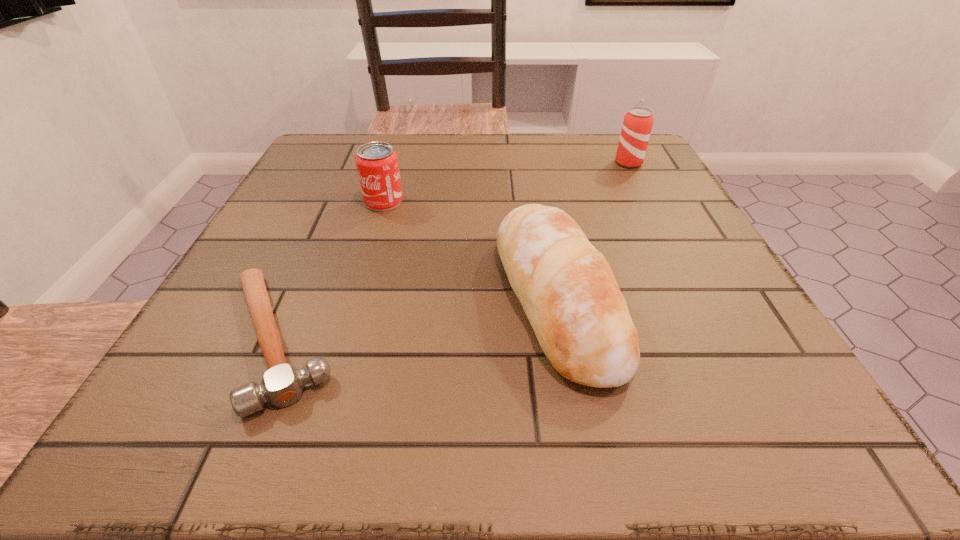
The image size is (960, 540). I want to click on the farthest object, so click(638, 121).

The height and width of the screenshot is (540, 960). Identify the location of the rightmost object. (638, 121).

Image resolution: width=960 pixels, height=540 pixels. Identify the location of can. (377, 165).

Identify the location of the second object from right to left. (567, 289).

This screenshot has width=960, height=540. Identify the location of hammer. (282, 384).

The image size is (960, 540). I want to click on vacant space located 0.310m on the left of the beer can, so click(485, 163).

This screenshot has height=540, width=960. I want to click on vacant region located 0.180m on the front of the can, so click(x=363, y=271).

Find the location of `vacant space located on the back of the bread`. vacant space located on the back of the bread is located at coordinates pos(540,214).

Locate an element on the screen. Image resolution: width=960 pixels, height=540 pixels. free region located on the right of the hammer is located at coordinates (548, 339).

Image resolution: width=960 pixels, height=540 pixels. Find the location of `object at the far edge`. object at the far edge is located at coordinates (638, 121).